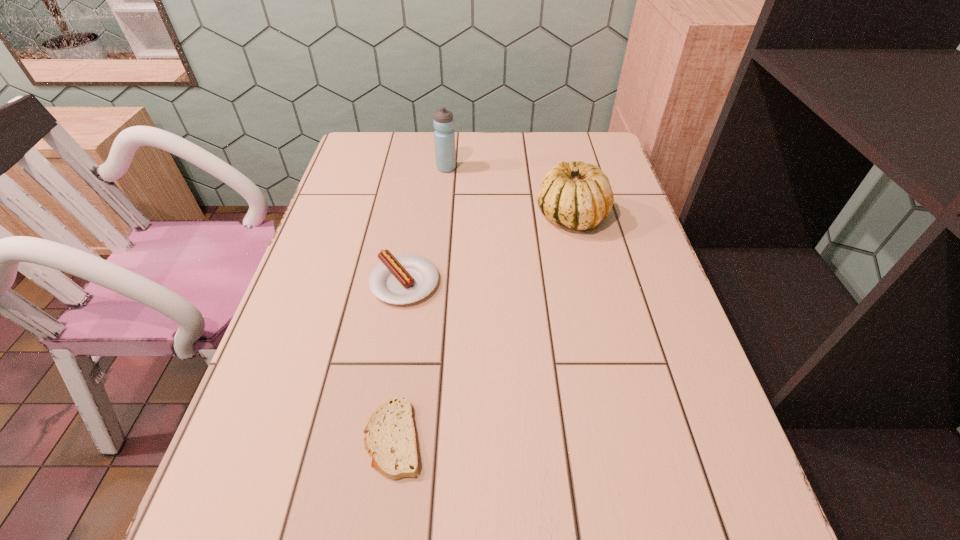
This screenshot has height=540, width=960. I want to click on free space between the pita bread and the second tallest object, so click(x=482, y=328).

Where is `unoccupied area between the farthest object and the third shortest object`? unoccupied area between the farthest object and the third shortest object is located at coordinates (509, 193).

I want to click on blank region between the gourd and the pita bread, so click(482, 328).

Where is `empty space between the rightmost object and the third tallest object`? The height and width of the screenshot is (540, 960). empty space between the rightmost object and the third tallest object is located at coordinates (488, 249).

This screenshot has height=540, width=960. Identify the location of free space that is in between the tallest object and the nearest object. (420, 303).

Locate an element on the screen. The width and height of the screenshot is (960, 540). free spot between the pita bread and the second nearest object is located at coordinates (398, 360).

Find the location of a particular element. This screenshot has height=540, width=960. unoccupied position between the shortest object and the sausage is located at coordinates (x=398, y=360).

Identify the location of free area in between the sausage and the gourd. The width and height of the screenshot is (960, 540). (488, 249).

At what (x,y) coordinates should I click in order to perform the action: click on vacant area between the second nearest object and the farthest object. Please return your answer as a coordinate pair (x, y). This screenshot has height=540, width=960. Looking at the image, I should click on (425, 225).

You are a GUI agent. You are given a task and a screenshot of the screen. Output one action in this format:
    pyautogui.click(x=<x>, y=<y>)
    Task: Click on the object that is the second closest to the gourd
    
    Given the screenshot: What is the action you would take?
    pyautogui.click(x=407, y=278)